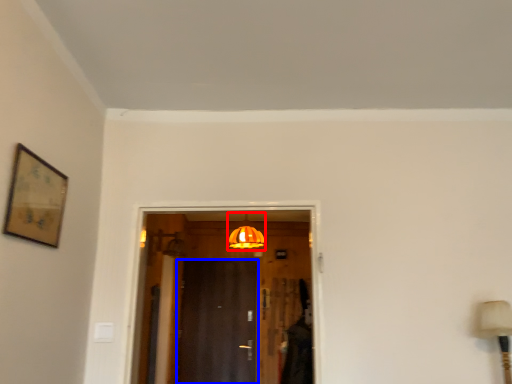
Question: Which object appears farthest to the camera in this image, light fixture (highlighted by a red box) or door (highlighted by a blue box)?

Choices:
 (A) light fixture
 (B) door

Answer: (B)